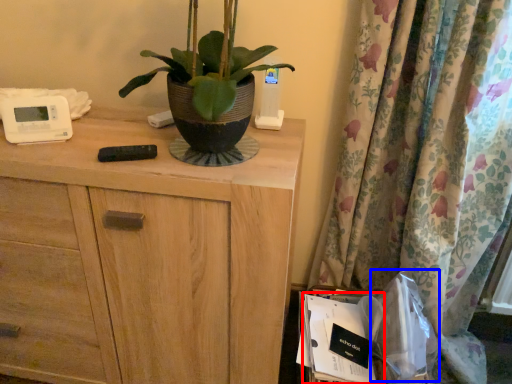
Question: Which object appears farthest to the camera in this image, paperback book (highlighted by a red box) or paper bag (highlighted by a blue box)?

Choices:
 (A) paperback book
 (B) paper bag

Answer: (A)